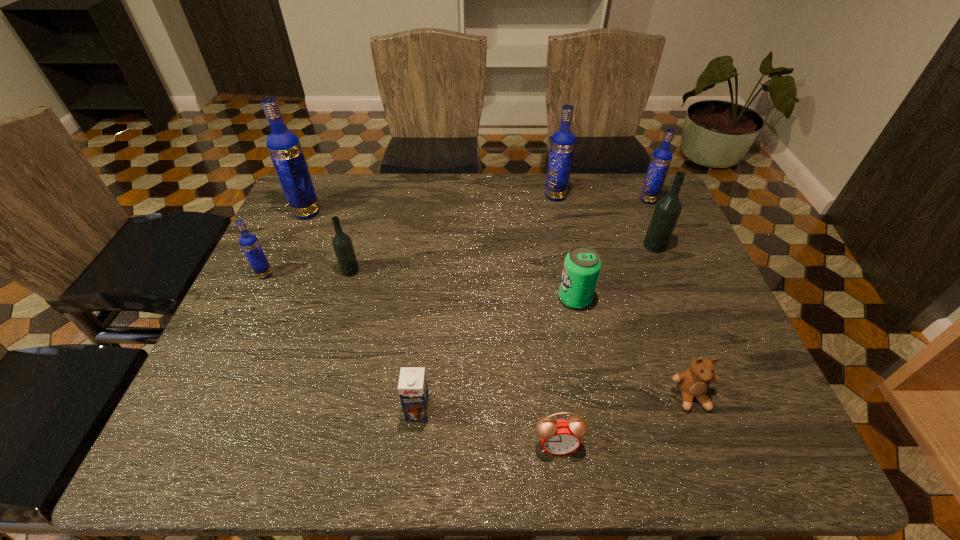
The width and height of the screenshot is (960, 540). I want to click on free location at the left edge of the desktop, so click(x=279, y=232).

In the image, there is a desktop. In order to click on vacant space at the right edge in this screenshot , I will do `click(644, 256)`.

You are a GUI agent. You are given a task and a screenshot of the screen. Output one action in this format:
    pyautogui.click(x=<x>, y=<y>)
    Task: Click on the vacant space at the far left corner of the desktop
    
    Given the screenshot: What is the action you would take?
    pyautogui.click(x=333, y=212)

Where is `vacant space at the near left corner of the desktop`? Image resolution: width=960 pixels, height=540 pixels. vacant space at the near left corner of the desktop is located at coordinates (252, 421).

Identify the location of empty location between the seventh farthest object and the fourth vodka from right to left. The width and height of the screenshot is (960, 540). (463, 285).

The image size is (960, 540). Find the location of `vacant region between the rightmost blue vodka and the left black vodka`. vacant region between the rightmost blue vodka and the left black vodka is located at coordinates (499, 235).

Where is `free spot between the pop soda and the third blue vodka from left to right`? free spot between the pop soda and the third blue vodka from left to right is located at coordinates (565, 247).

Image resolution: width=960 pixels, height=540 pixels. What are the coordinates of `free space between the seventh nearest object and the nearest blue vodka` in the screenshot? It's located at (460, 260).

You are a GUI agent. You are given a task and a screenshot of the screen. Output one action in this format:
    pyautogui.click(x=<x>, y=<y>)
    Task: Click on the blank region between the third object from left to right and the smallest blue vodka
    This screenshot has height=540, width=960.
    Given the screenshot: What is the action you would take?
    pyautogui.click(x=307, y=273)

Where is `vacant space that is in between the tallest object and the rightmost blue vodka`? This screenshot has width=960, height=540. vacant space that is in between the tallest object and the rightmost blue vodka is located at coordinates (477, 206).